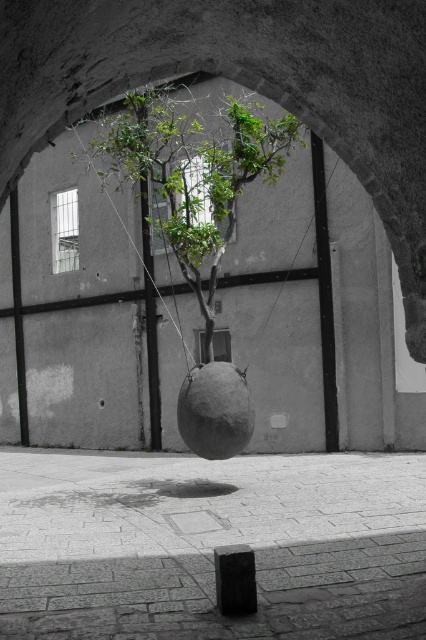
You are an architect examining the structural integrity of the black stone at lower center and the black matte string at center. Which object has a smaller diameter?

The black stone at lower center has a smaller diameter than the black matte string at center.

You are an architect examining the old building and notice the black stone at lower center and the black matte string at center. Which object is positioned nearer to you?

The black stone at lower center is closer to the viewer than the black matte string at center.

You are an interior designer planning to place a new piece of furniture in this historical building. You have two options from the image, the green leafy tree at center and the green leafy plant at center. Which one requires more horizontal space due to its width?

The green leafy tree at center requires more horizontal space because its width surpasses that of the green leafy plant at center.